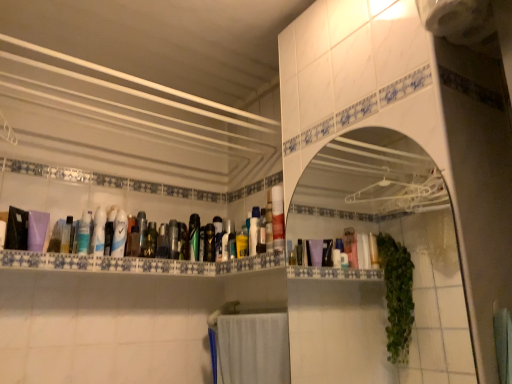
Question: Is point (218, 221) positioned closer to the camera than point (165, 251)?

Choices:
 (A) farther
 (B) closer

Answer: (A)

Question: In terms of size, does matte plastic mouthwash at center, which appears as the 8th mouthwash when viewed from the left, appear bigger or smaller than translucent plastic mouthwash at center, positioned as the 6th mouthwash in right-to-left order?

Choices:
 (A) small
 (B) big

Answer: (B)

Question: Which of these objects is positioned closest to the translucent plastic mouthwash at left, the first mouthwash in the left-to-right sequence?

Choices:
 (A) matte black lotion at center, which is the first toiletry from left to right
 (B) translucent plastic mouthwash at upper left, placed as the ninth mouthwash when sorted from right to left
 (C) green glossy bottle at center, which appears as the 4th mouthwash when viewed from the right
 (D) matte black bottle at center, which is the second toiletry in right-to-left order
 (E) green matte bottle at center, the 3th toiletry from the right

Answer: (B)

Question: Estimate the real-world distances between objects in this image. Which object is farther from the matte black lotion at center, which is the first toiletry from left to right?

Choices:
 (A) clear plastic bottles at center
 (B) translucent plastic mouthwash at left, the tenth mouthwash viewed from the right
 (C) green matte bottle at center, placed as the third toiletry when sorted from left to right
 (D) white glossy mouthwash at upper left, the 3th mouthwash in the left-to-right sequence
 (E) white glossy mouthwash at center, which is the fourth mouthwash from left to right

Answer: (A)